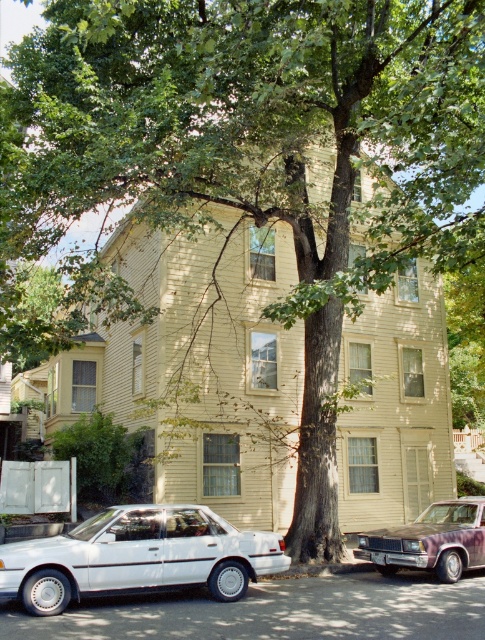
You are driving a delivery van that is 1.8 meters wide. You need to park between the white matte sedan at lower left and the purple metallic sedan at lower right. Can your van fit in the space between them?

The white matte sedan at lower left is bigger than the purple metallic sedan at lower right, but the exact distance between them isn

You are a delivery driver approaching the house and need to park your vehicle. The driveway is narrow and only allows one car to park at a time. Which parking spot is closer to the house between the white matte sedan at lower left and the purple metallic sedan at lower right?

The white matte sedan at lower left is closer to the house because it is positioned to the left of the purple metallic sedan at lower right, which is further away from the house.

You are driving a delivery van that is 6 feet tall and need to park in the driveway between the white matte sedan at lower left and the purple metallic sedan at lower right. The driveway has a height restriction of 6.5 feet. Can your van fit between them without hitting the height limit?

The white matte sedan at lower left is much taller than the purple metallic sedan at lower right. Since the white matte sedan at lower left is taller, its height would determine the maximum clearance. If the white matte sedan at lower left is taller than 6.5 feet, your van might not fit. However, the problem states the driveway has a 6.5 feet height restriction, and your van is 6 feet tall. Assuming the height restriction is the limiting factor, your van can fit under the 6.5 feet limit. But the question is